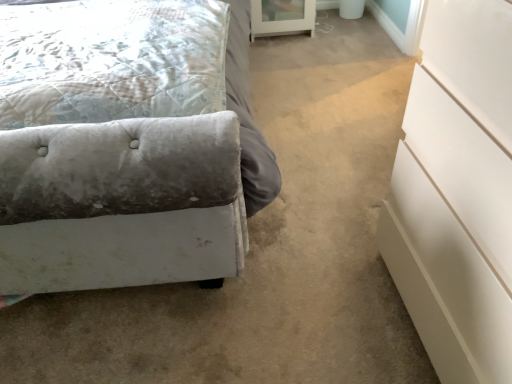
Question: Is point (480, 140) closer or farther from the camera than point (300, 24)?

Choices:
 (A) closer
 (B) farther

Answer: (A)

Question: Based on their sizes in the image, would you say white glossy chest of drawers at right is bigger or smaller than white glass cabinet at upper center?

Choices:
 (A) big
 (B) small

Answer: (A)

Question: Based on their relative distances, which object is farther from the white glossy chest of drawers at right?

Choices:
 (A) white glass cabinet at upper center
 (B) velvet gray bed at lower left
 (C) velvet tufted pillow at left

Answer: (A)

Question: Estimate the real-world distances between objects in this image. Which object is closer to the white glass cabinet at upper center?

Choices:
 (A) velvet tufted pillow at left
 (B) velvet gray bed at lower left
 (C) white glossy chest of drawers at right

Answer: (B)